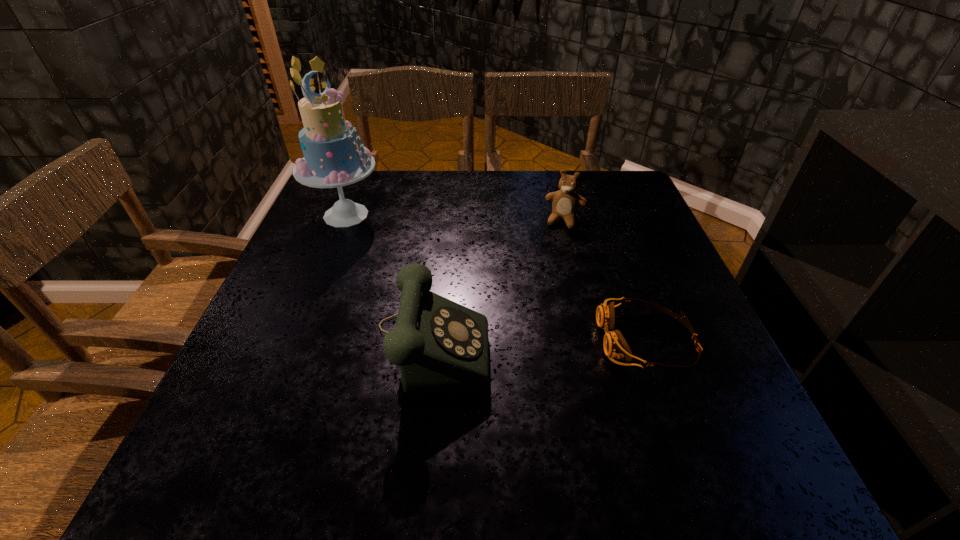
Locate an element on the screen. Image resolution: width=960 pixels, height=540 pixels. object at the right edge is located at coordinates (615, 346).

The image size is (960, 540). In order to click on object present at the far left corner in this screenshot , I will do `click(332, 159)`.

The width and height of the screenshot is (960, 540). I want to click on vacant area at the far edge, so 495,210.

Locate an element on the screen. vacant space at the near edge of the desktop is located at coordinates (527, 424).

Image resolution: width=960 pixels, height=540 pixels. What are the coordinates of `free spot at the left edge of the desktop` in the screenshot? It's located at (325, 268).

The height and width of the screenshot is (540, 960). In order to click on vacant space at the right edge in this screenshot , I will do `click(659, 323)`.

Find the location of a particular element. free region at the far left corner of the desktop is located at coordinates (372, 191).

In the image, there is a desktop. Where is `vacant space at the near right corner`? vacant space at the near right corner is located at coordinates (691, 382).

Find the location of `vacant area that lies between the teddy bear and the leftmost object`. vacant area that lies between the teddy bear and the leftmost object is located at coordinates (456, 218).

Find the location of a particular element. This screenshot has height=540, width=960. free space between the third tallest object and the third shortest object is located at coordinates (498, 279).